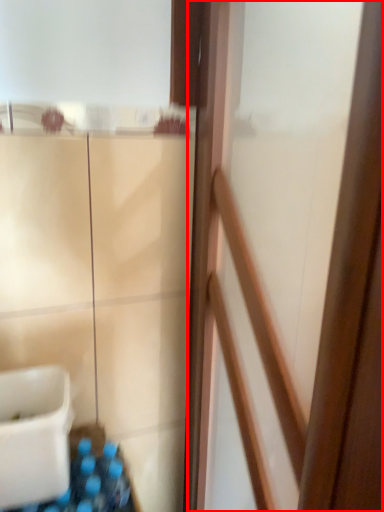
Question: From the image's perspective, where is screen door (annotated by the red box) located in relation to sink in the image?

Choices:
 (A) below
 (B) above

Answer: (B)